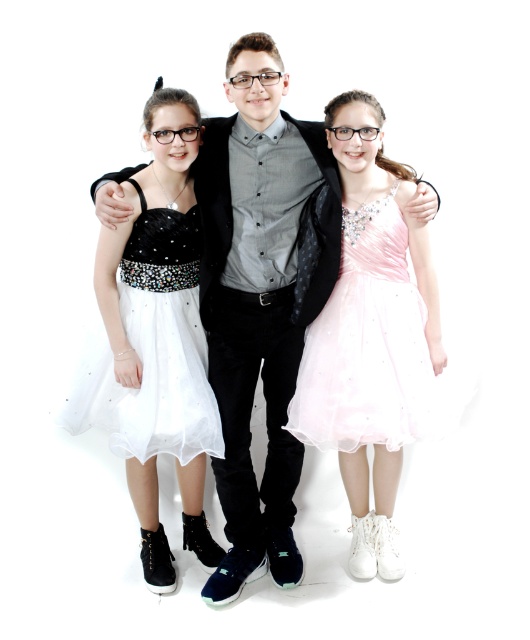
Question: Does matte black shirt at center have a lesser width compared to white tulle dress at left?

Choices:
 (A) no
 (B) yes

Answer: (A)

Question: Is matte black shirt at center positioned before pink satin dress at center?

Choices:
 (A) yes
 (B) no

Answer: (A)

Question: Is matte black shirt at center closer to camera compared to white tulle dress at left?

Choices:
 (A) no
 (B) yes

Answer: (B)

Question: Which point is farther to the camera?

Choices:
 (A) matte black shirt at center
 (B) white tulle dress at left
 (C) pink satin dress at center

Answer: (B)

Question: Which point appears farthest from the camera in this image?

Choices:
 (A) (338, 387)
 (B) (270, 460)

Answer: (B)

Question: Which point is farther to the camera?

Choices:
 (A) white tulle dress at left
 (B) pink satin dress at center
 (C) matte black shirt at center

Answer: (A)